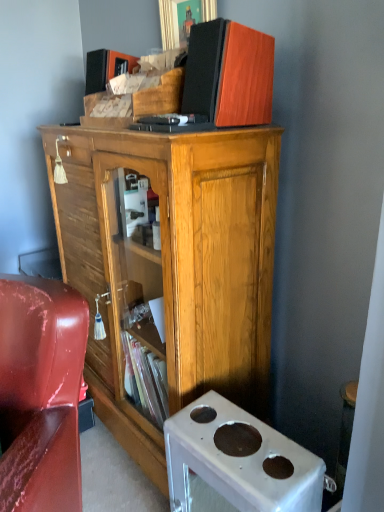
Question: Should I look upward or downward to see wooden speaker at upper center?

Choices:
 (A) down
 (B) up

Answer: (B)

Question: Is glossy leather chair at lower left aimed at wooden speaker at upper center?

Choices:
 (A) yes
 (B) no

Answer: (B)

Question: Is glossy leather chair at lower left smaller than wooden speaker at upper center?

Choices:
 (A) yes
 (B) no

Answer: (B)

Question: Is glossy leather chair at lower left to the right of wooden speaker at upper center from the viewer's perspective?

Choices:
 (A) yes
 (B) no

Answer: (B)

Question: Is glossy leather chair at lower left positioned beyond the bounds of wooden speaker at upper center?

Choices:
 (A) yes
 (B) no

Answer: (A)

Question: Is glossy leather chair at lower left closer to camera compared to wooden speaker at upper center?

Choices:
 (A) no
 (B) yes

Answer: (B)

Question: Is glossy leather chair at lower left shorter than wooden speaker at upper center?

Choices:
 (A) no
 (B) yes

Answer: (A)

Question: Is white plastic desk at lower right facing towards glossy leather chair at lower left?

Choices:
 (A) yes
 (B) no

Answer: (B)

Question: From a real-world perspective, is white plastic desk at lower right positioned over glossy leather chair at lower left based on gravity?

Choices:
 (A) no
 (B) yes

Answer: (A)

Question: Considering the relative sizes of white plastic desk at lower right and glossy leather chair at lower left in the image provided, is white plastic desk at lower right taller than glossy leather chair at lower left?

Choices:
 (A) yes
 (B) no

Answer: (B)

Question: Is white plastic desk at lower right bigger than glossy leather chair at lower left?

Choices:
 (A) yes
 (B) no

Answer: (B)

Question: Is white plastic desk at lower right not close to glossy leather chair at lower left?

Choices:
 (A) no
 (B) yes

Answer: (A)

Question: From a real-world perspective, is white plastic desk at lower right beneath glossy leather chair at lower left?

Choices:
 (A) yes
 (B) no

Answer: (A)

Question: Does glossy leather chair at lower left have a lesser height compared to wooden cabinet at center?

Choices:
 (A) yes
 (B) no

Answer: (A)